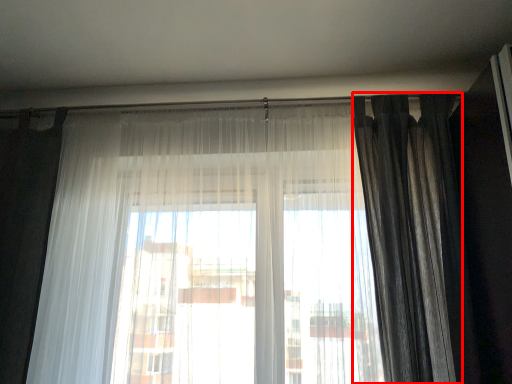
Question: In this image, where is curtain (annotated by the red box) located relative to curtain?

Choices:
 (A) left
 (B) right

Answer: (B)